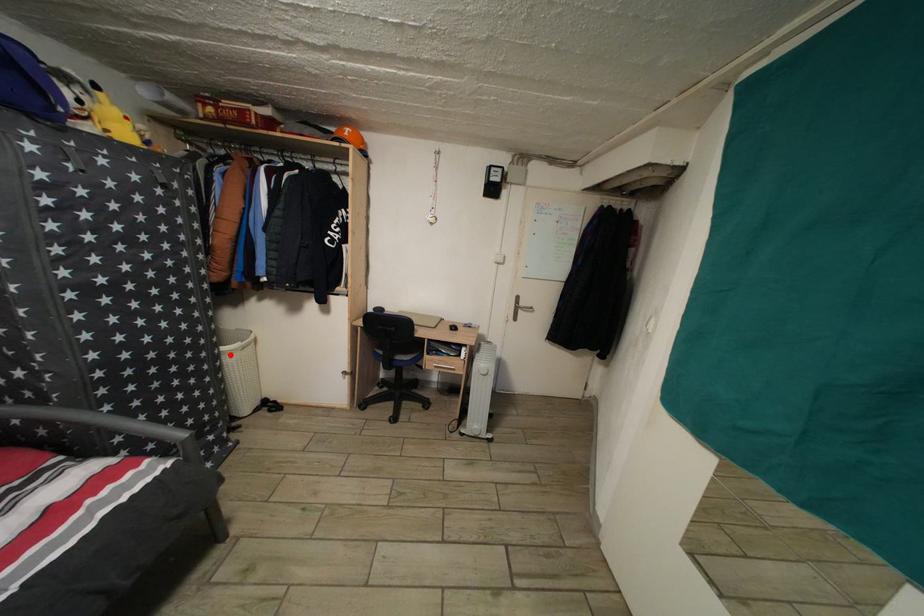
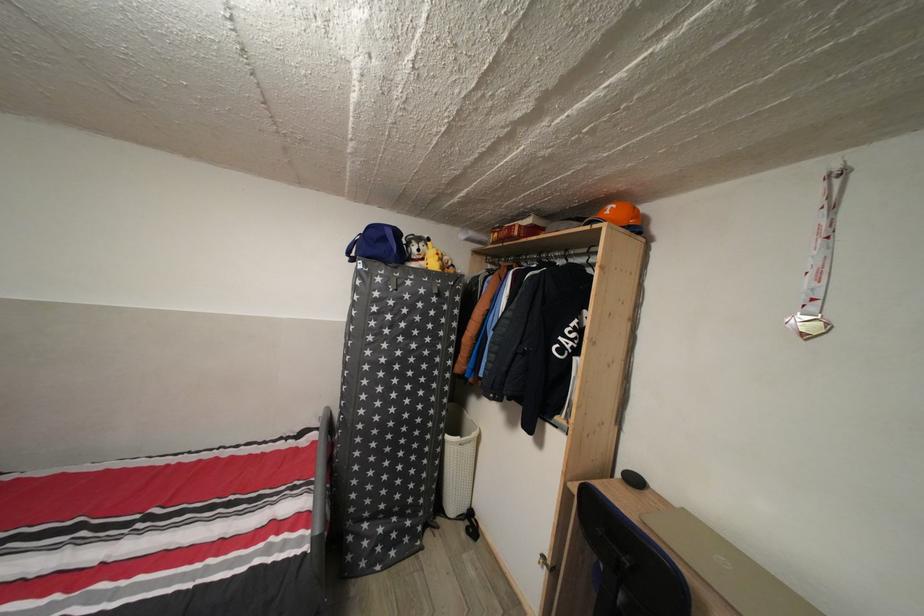
Where in the second image is the point corresponding to the highlighted location from the first image?

(455, 444)